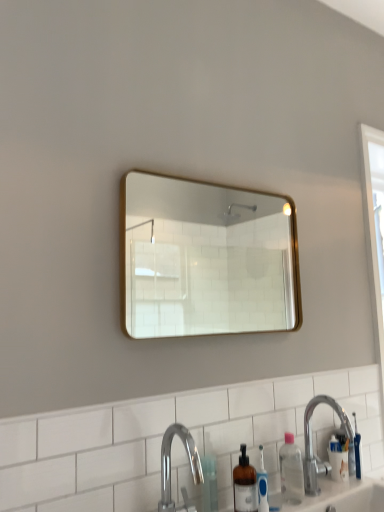
Question: From the image's perspective, relative to white wood screen door at right, is polished chrome faucet at lower center above or below?

Choices:
 (A) below
 (B) above

Answer: (A)

Question: Considering the positions of polished chrome faucet at lower center and white wood screen door at right in the image, is polished chrome faucet at lower center bigger or smaller than white wood screen door at right?

Choices:
 (A) small
 (B) big

Answer: (A)

Question: Which is farther from the clear plastic bottle at lower right?

Choices:
 (A) silver metallic sink at lower right
 (B) translucent plastic bottle at lower center
 (C) gold-framed mirror at upper center
 (D) white wood screen door at right
 (E) polished chrome faucet at lower center

Answer: (C)

Question: Estimate the real-world distances between objects in this image. Which object is closer to the translucent plastic bottle at lower center?

Choices:
 (A) silver metallic sink at lower right
 (B) white wood screen door at right
 (C) clear plastic bottle at lower right
 (D) polished chrome faucet at lower center
 (E) gold-framed mirror at upper center

Answer: (D)